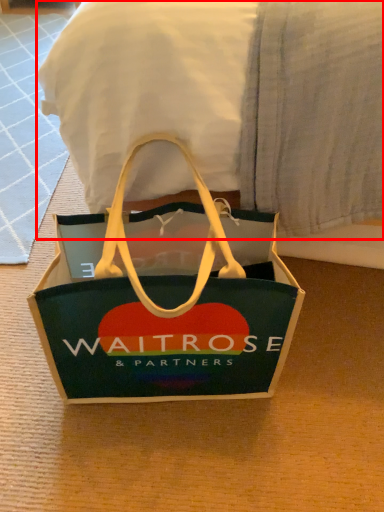
Question: From the image's perspective, where is bedding (annotated by the red box) located relative to handbag?

Choices:
 (A) below
 (B) above

Answer: (B)